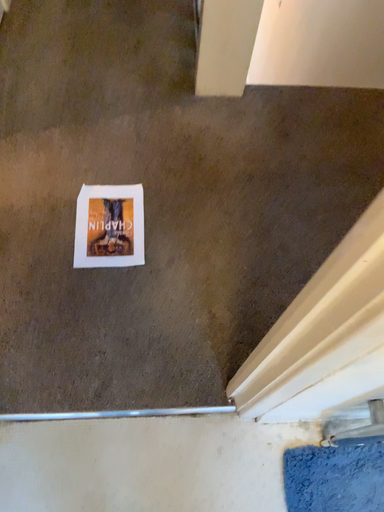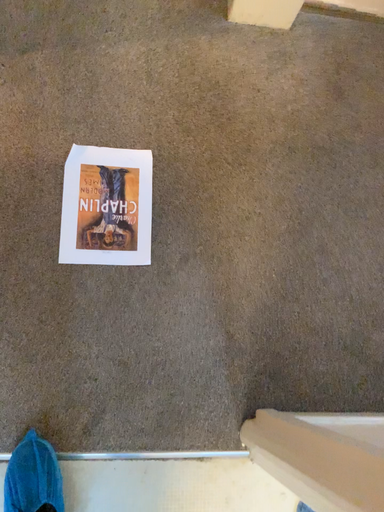
Question: Which way did the camera rotate in the video?

Choices:
 (A) rotated downward
 (B) rotated upward

Answer: (A)